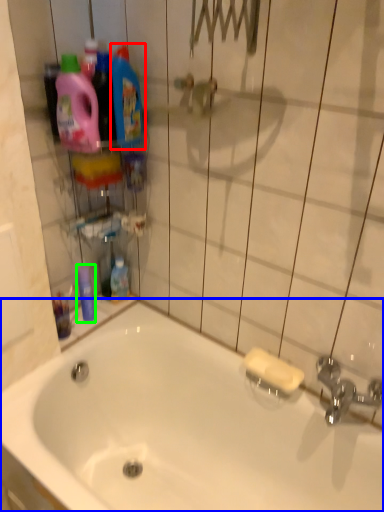
Question: Which object is positioned closest to cleaning product (highlighted by a red box)? Select from bathtub (highlighted by a blue box) and mouthwash (highlighted by a green box).

Choices:
 (A) bathtub
 (B) mouthwash

Answer: (B)